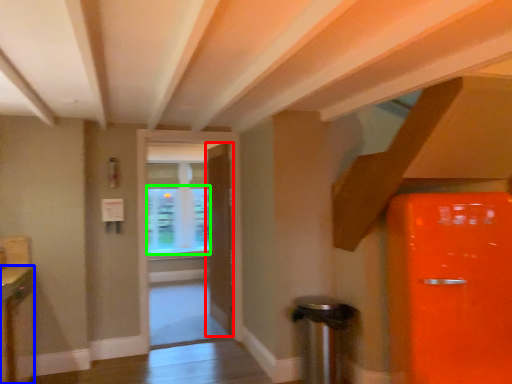
Question: Which object is the closest to the door (highlighted by a red box)? Choose among these: cabinetry (highlighted by a blue box) or window screen (highlighted by a green box).

Choices:
 (A) cabinetry
 (B) window screen

Answer: (B)